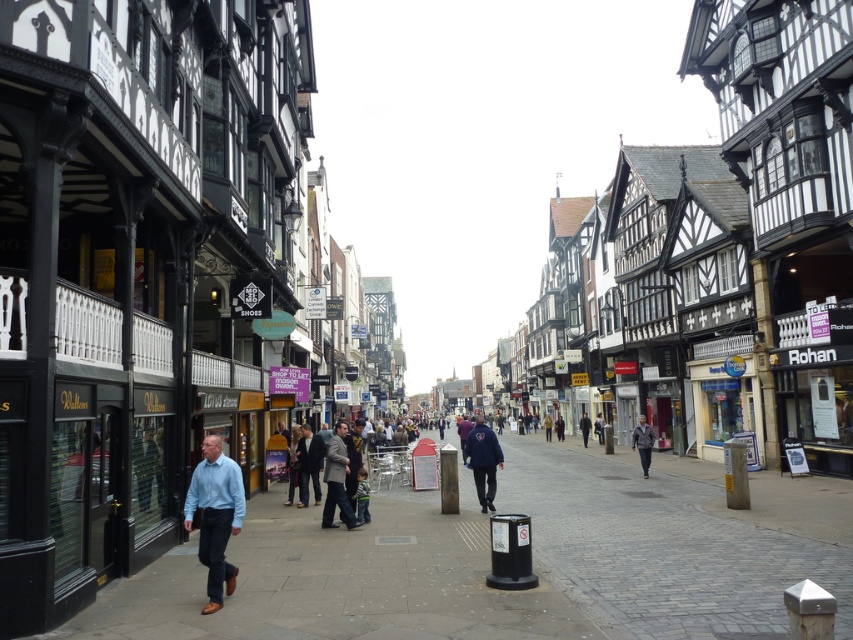
Between light blue shirt at lower left and gray fabric jacket at center, which one has more height?

With more height is light blue shirt at lower left.

Between light blue shirt at lower left and gray fabric jacket at center, which one is positioned higher?

light blue shirt at lower left

Which is behind, point (242, 499) or point (648, 449)?

Positioned behind is point (648, 449).

This screenshot has height=640, width=853. I want to click on light blue shirt at lower left, so [x=215, y=516].

Between dark gray suit at center and light brown leather jacket at center, which one has more height?

dark gray suit at center

Between dark gray suit at center and light brown leather jacket at center, which one is positioned lower?

light brown leather jacket at center is lower down.

Measure the distance between dark gray suit at center and camera.

dark gray suit at center and camera are 21.41 meters apart from each other.

Locate an element on the screen. Image resolution: width=853 pixels, height=640 pixels. dark gray suit at center is located at coordinates (337, 480).

Who is taller, blue fleece jacket at center or dark blue jacket at center?

blue fleece jacket at center

Does blue fleece jacket at center appear on the right side of dark blue jacket at center?

In fact, blue fleece jacket at center is to the left of dark blue jacket at center.

You are a GUI agent. You are given a task and a screenshot of the screen. Output one action in this format:
    pyautogui.click(x=<x>, y=<y>)
    Task: Click on the blue fleece jacket at center
    
    Given the screenshot: What is the action you would take?
    pyautogui.click(x=483, y=460)